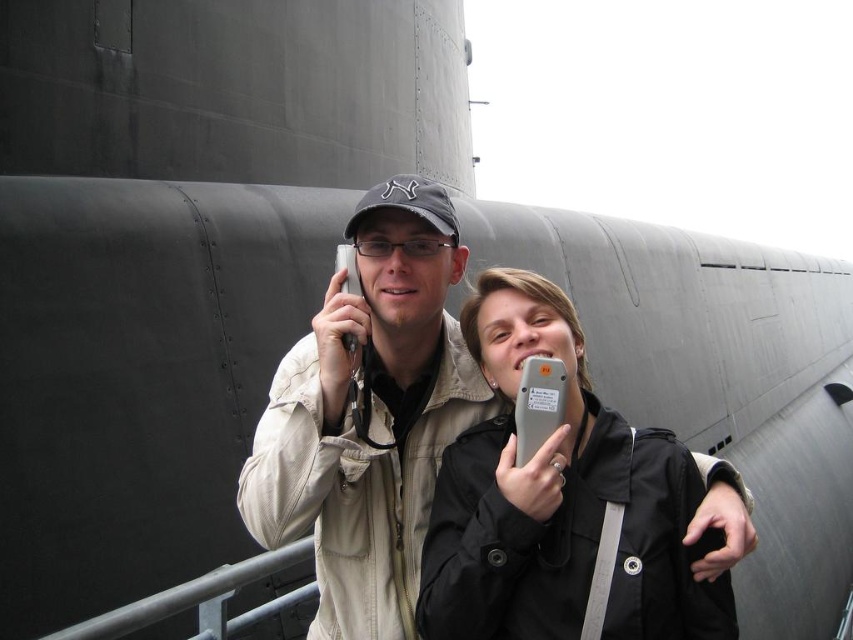
Question: Can you confirm if black matte jacket at center is positioned below matte beige jacket at center?

Choices:
 (A) no
 (B) yes

Answer: (B)

Question: Which point appears farthest from the camera in this image?

Choices:
 (A) (271, 512)
 (B) (668, 500)

Answer: (B)

Question: Does black matte jacket at center appear over matte beige jacket at center?

Choices:
 (A) no
 (B) yes

Answer: (A)

Question: Which point appears closest to the camera in this image?

Choices:
 (A) (421, 330)
 (B) (454, 596)

Answer: (B)

Question: Is black matte jacket at center further to camera compared to matte beige jacket at center?

Choices:
 (A) no
 (B) yes

Answer: (A)